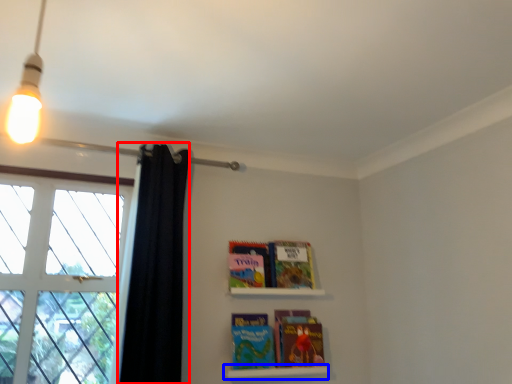
Question: Which point is further to the camera, shower curtain (highlighted by a red box) or shelf (highlighted by a blue box)?

Choices:
 (A) shower curtain
 (B) shelf

Answer: (B)